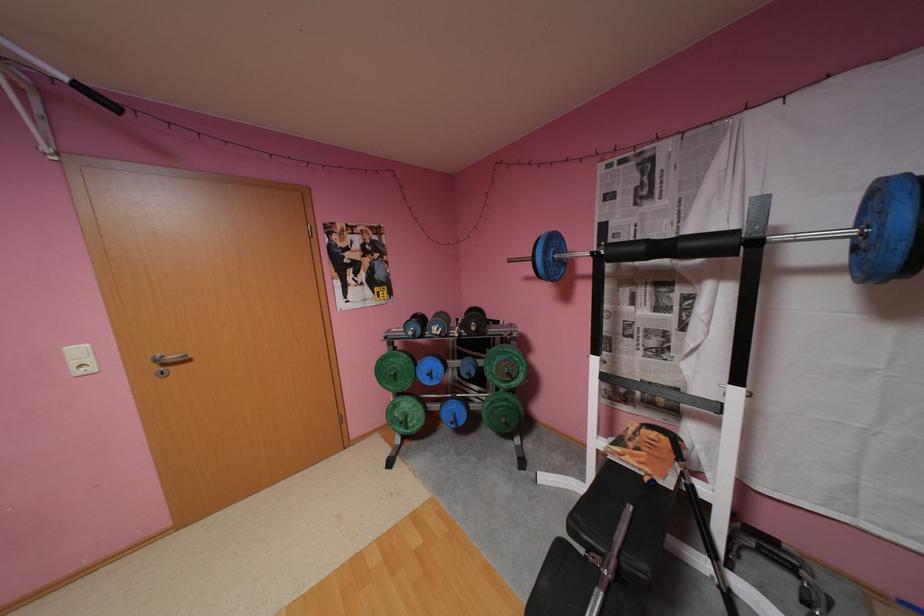
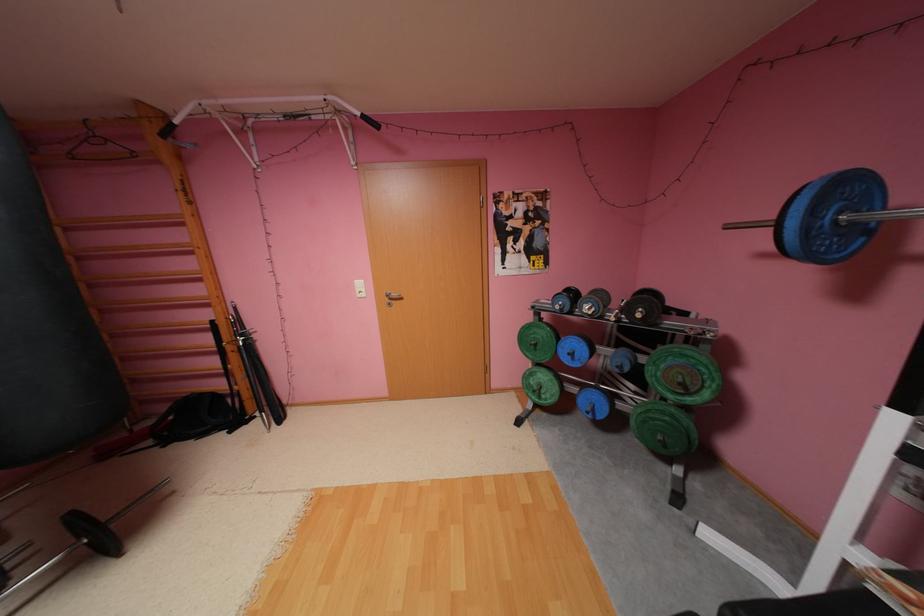
Find the pixel in the second image that matches [553,262] in the first image.

(816, 229)